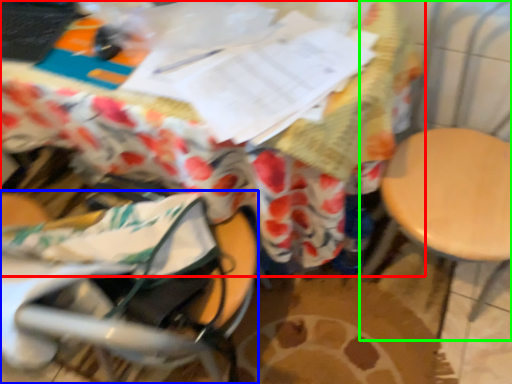
Question: Considering the real-world distances, which object is farthest from table (highlighted by a red box)? baby carriage (highlighted by a blue box) or swivel chair (highlighted by a green box)?

Choices:
 (A) baby carriage
 (B) swivel chair

Answer: (B)